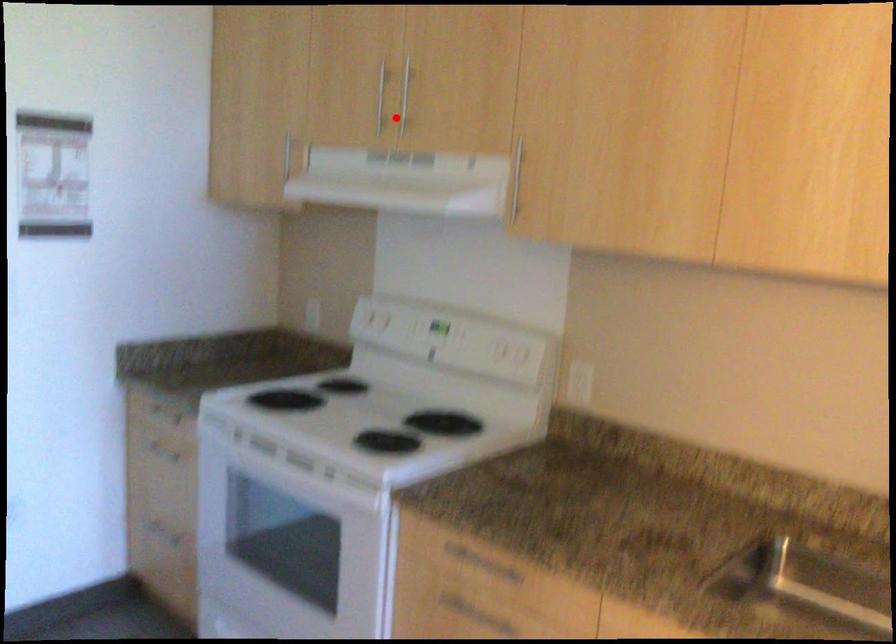
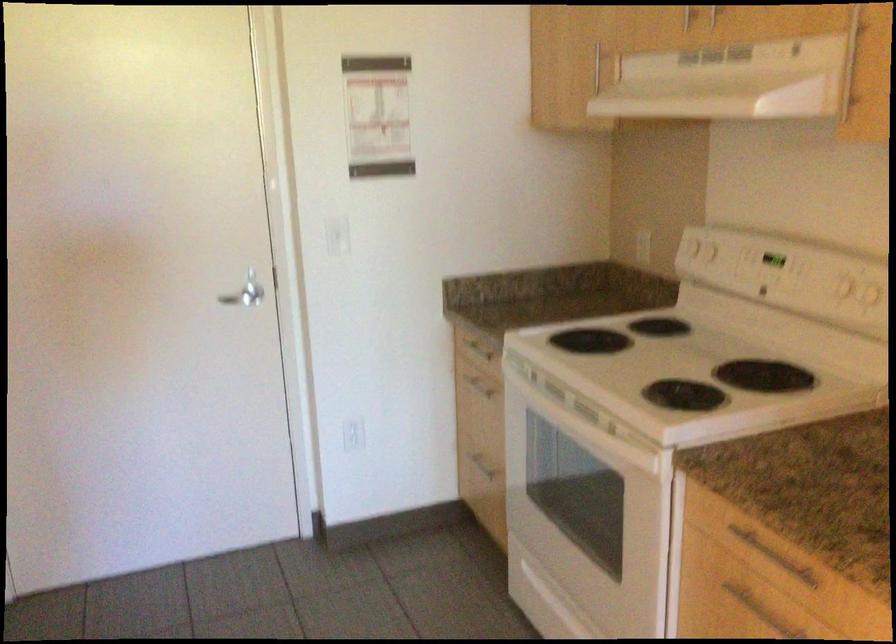
Question: I am providing you with two images of the same scene from different viewpoints. Image1 has a red point marked. In image2, the corresponding 3D location appears at what relative position? Reply with the corresponding letter.

Choices:
 (A) Closer
 (B) Farther

Answer: (A)